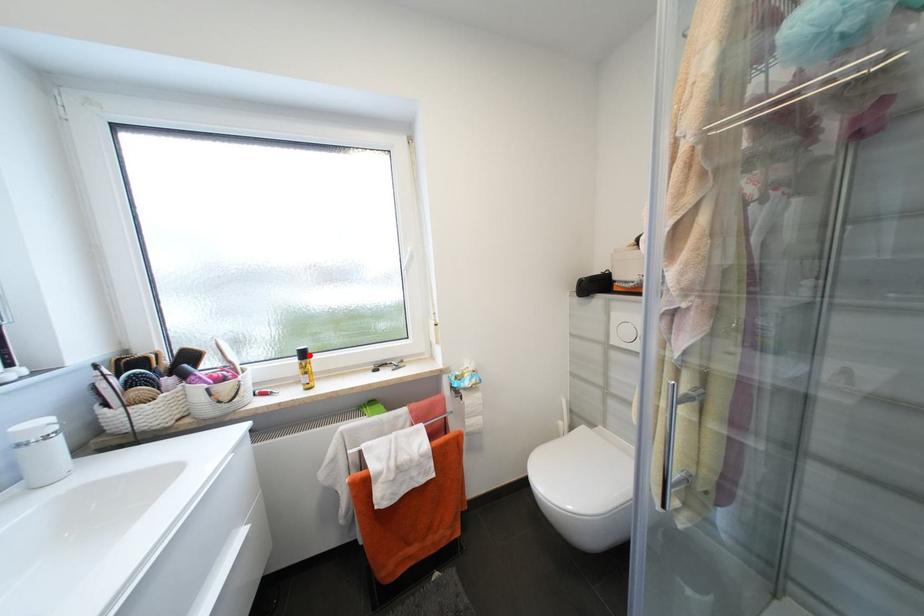
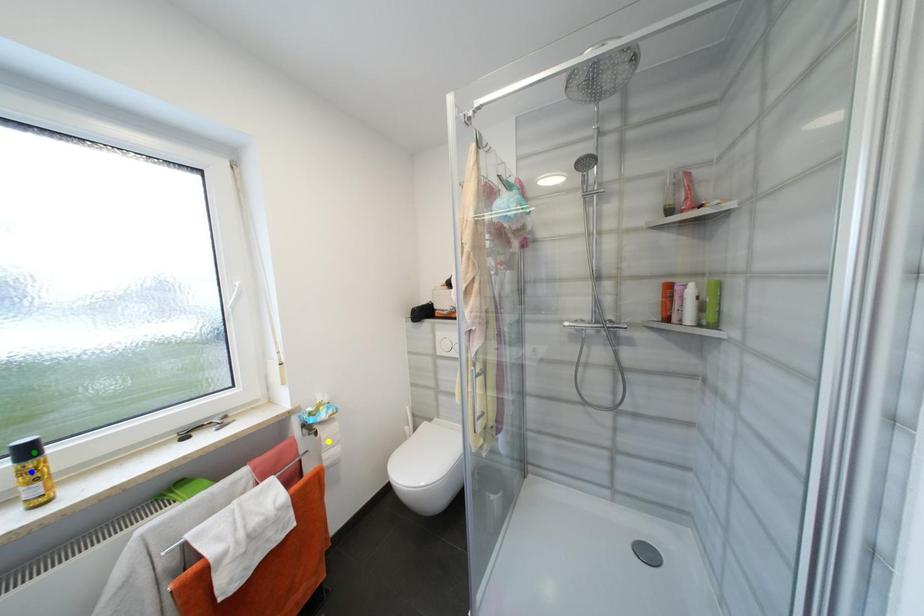
Question: I am providing you with two images of the same scene from different viewpoints. A red point is marked on the first image. You are given multiple points on the second image. Which spot in image 2 lines up with the point in image 1?

Choices:
 (A) blue point
 (B) green point
 (C) yellow point

Answer: (B)